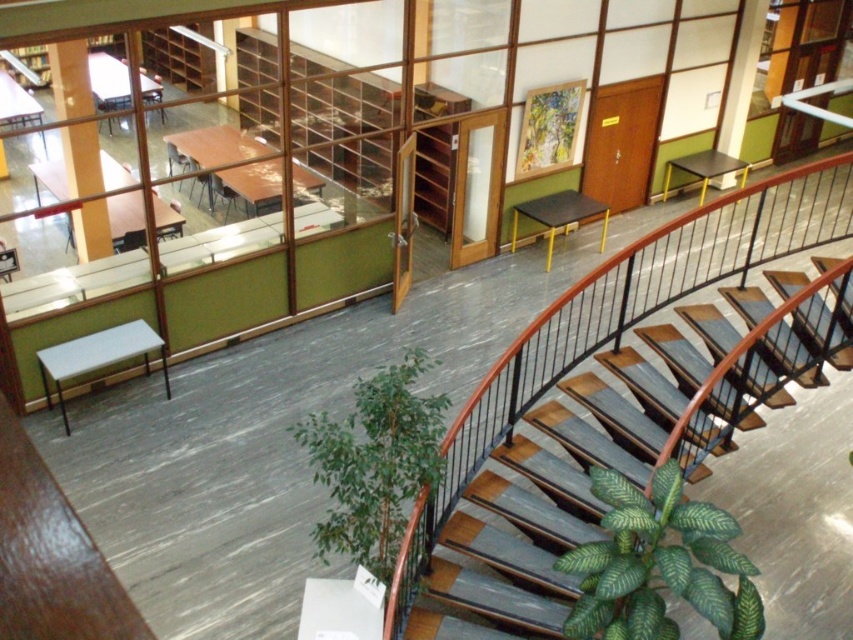
Which of these two, wooden stairs at center or green leafy plant at center, stands shorter?

With less height is green leafy plant at center.

Which is in front, point (468, 609) or point (368, 493)?

Point (368, 493) is in front.

Locate an element on the screen. The image size is (853, 640). wooden stairs at center is located at coordinates (624, 448).

You are a GUI agent. You are given a task and a screenshot of the screen. Output one action in this format:
    pyautogui.click(x=<x>, y=<y>)
    Task: Click on the wooden stairs at center
    The height and width of the screenshot is (640, 853).
    Given the screenshot: What is the action you would take?
    pyautogui.click(x=624, y=448)

Who is taller, wooden stairs at center or matte white pillar at upper left?

wooden stairs at center is taller.

The width and height of the screenshot is (853, 640). What do you see at coordinates (624, 448) in the screenshot?
I see `wooden stairs at center` at bounding box center [624, 448].

In order to click on wooden stairs at center in this screenshot , I will do `click(624, 448)`.

Looking at this image, can you confirm if green glossy plant at bottom right is wider than matte white pillar at upper right?

Correct, the width of green glossy plant at bottom right exceeds that of matte white pillar at upper right.

Does green glossy plant at bottom right have a lesser height compared to matte white pillar at upper right?

Indeed, green glossy plant at bottom right has a lesser height compared to matte white pillar at upper right.

Identify the location of green glossy plant at bottom right. The image size is (853, 640). (659, 564).